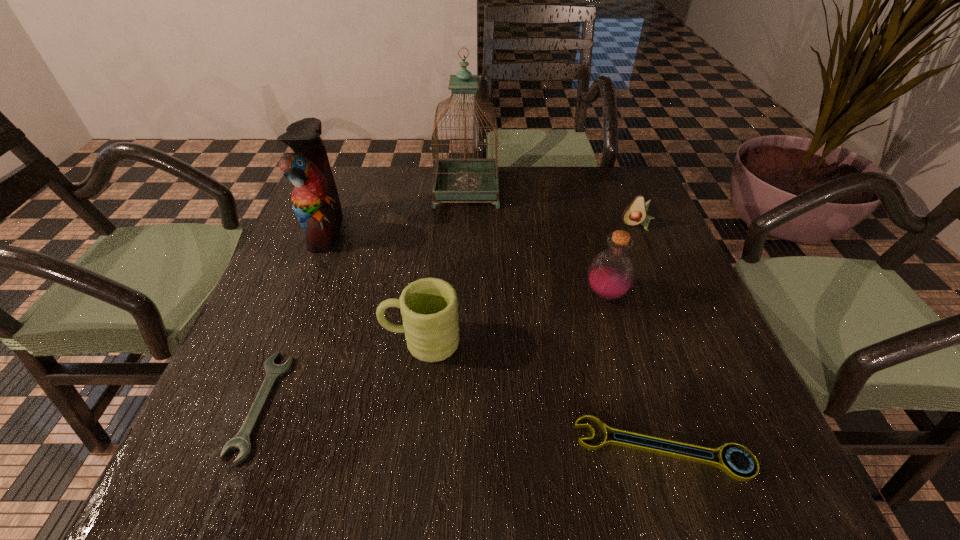
The height and width of the screenshot is (540, 960). I want to click on birdcage, so click(x=454, y=179).

You are a GUI agent. You are given a task and a screenshot of the screen. Output one action in this format:
    pyautogui.click(x=<x>, y=<y>)
    Task: Click on the second tallest object
    The image size is (960, 540).
    Given the screenshot: What is the action you would take?
    pyautogui.click(x=315, y=200)

Find the location of a particular element. Image resolution: width=960 pixels, height=540 pixels. the third tallest object is located at coordinates (611, 273).

Image resolution: width=960 pixels, height=540 pixels. What are the coordinates of `the fourth nearest object` in the screenshot? It's located at (611, 273).

Identify the location of mug. (429, 308).

Identify the location of the third shortest object. The height and width of the screenshot is (540, 960). (635, 213).

The height and width of the screenshot is (540, 960). I want to click on the right wrench, so click(x=724, y=464).

Where is `the left wrench`? The image size is (960, 540). the left wrench is located at coordinates (241, 441).

Image resolution: width=960 pixels, height=540 pixels. Find the location of `vacant region located at the door of the birdcage`. vacant region located at the door of the birdcage is located at coordinates point(606,190).

Locate an element on the screen. The height and width of the screenshot is (540, 960). vacant space located at the face of the sixth shortest object is located at coordinates (454, 230).